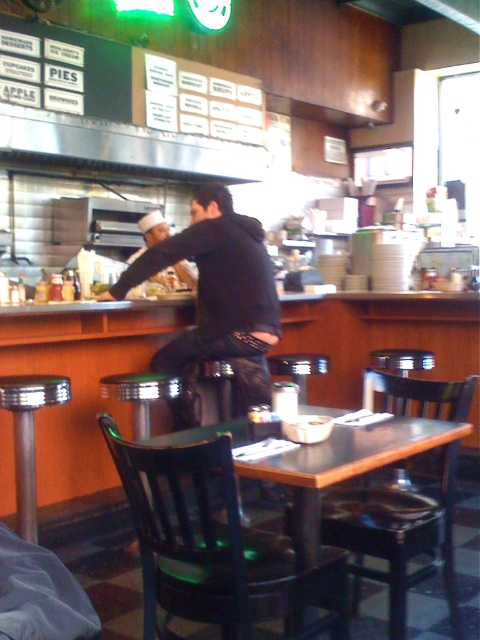
Question: Can you confirm if shiny chrome bar stool at lower left is bigger than brushed metal bar stool at lower left?

Choices:
 (A) yes
 (B) no

Answer: (A)

Question: Is black wood chair at lower center in front of shiny chrome bar stool at lower left?

Choices:
 (A) yes
 (B) no

Answer: (A)

Question: Which of the following is the closest to the observer?

Choices:
 (A) (208, 550)
 (B) (215, 298)
 (C) (417, 467)
 (D) (147, 404)

Answer: (A)

Question: Which is farther from the black wood chair at table?

Choices:
 (A) black wood chair at lower center
 (B) brushed metal bar stool at center

Answer: (B)

Question: Does black wood chair at lower center have a smaller size compared to brushed metal bar stool at center?

Choices:
 (A) no
 (B) yes

Answer: (A)

Question: Estimate the real-world distances between objects in this image. Which object is closer to the black wood chair at lower center?

Choices:
 (A) black leather jacket at center
 (B) black wood chair at table
 (C) shiny chrome bar stool at lower left

Answer: (B)